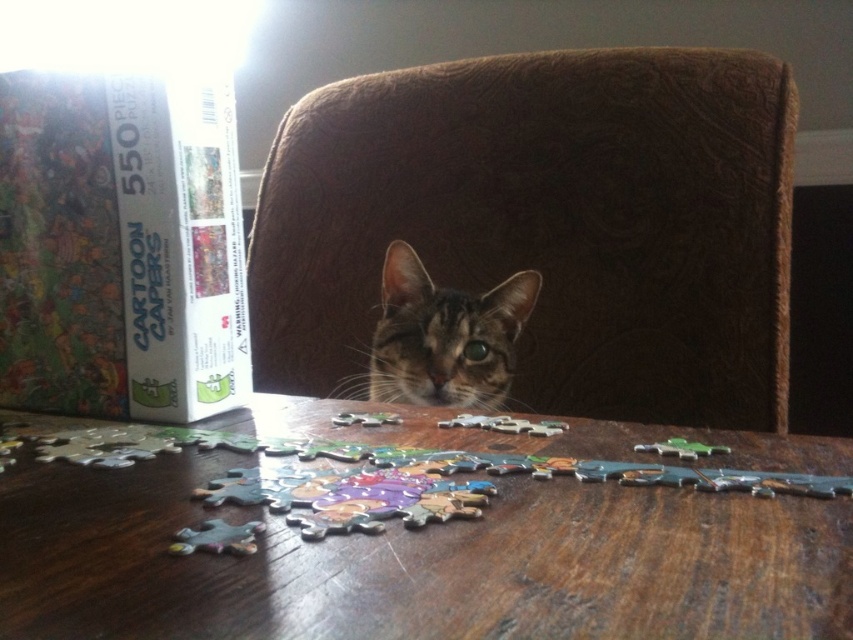
Question: Considering the relative positions of matte cardboard box at left and tabby fur cat at center in the image provided, where is matte cardboard box at left located with respect to tabby fur cat at center?

Choices:
 (A) right
 (B) left

Answer: (B)

Question: Based on their relative distances, which object is nearer to the wooden table at center?

Choices:
 (A) brown velvety chair at center
 (B) tabby fur cat at center

Answer: (B)

Question: Can you confirm if wooden table at center is wider than matte cardboard box at left?

Choices:
 (A) no
 (B) yes

Answer: (B)

Question: Which point appears farthest from the camera in this image?

Choices:
 (A) (531, 300)
 (B) (45, 342)
 (C) (520, 182)

Answer: (C)

Question: Which point is farther to the camera?

Choices:
 (A) (534, 292)
 (B) (843, 461)
 (C) (786, 116)
 (D) (212, 164)

Answer: (C)

Question: Is wooden table at center to the left of matte cardboard box at left from the viewer's perspective?

Choices:
 (A) no
 (B) yes

Answer: (A)